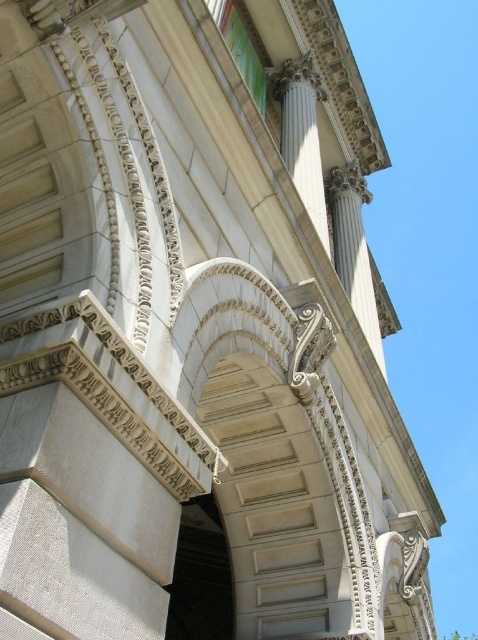
You are an architect examining the classical building structure. You notice two columns in the image, the white marble column at center and the white marble column at upper right. Which column is positioned closer to you?

The white marble column at center is closer to the viewer than the white marble column at upper right.

You are an architect examining the classical building facade. You notice two columns, the white marble column at center and the white marble column at upper right. Based on their positions and the architectural style, which column do you think is more likely to be the central supporting pillar of the structure?

The white marble column at center is more likely to be the central supporting pillar because it is positioned at the center of the structure and might be wider than the white marble column at upper right, which is typical in symmetrical classical designs where the central column is often emphasized through size and placement.